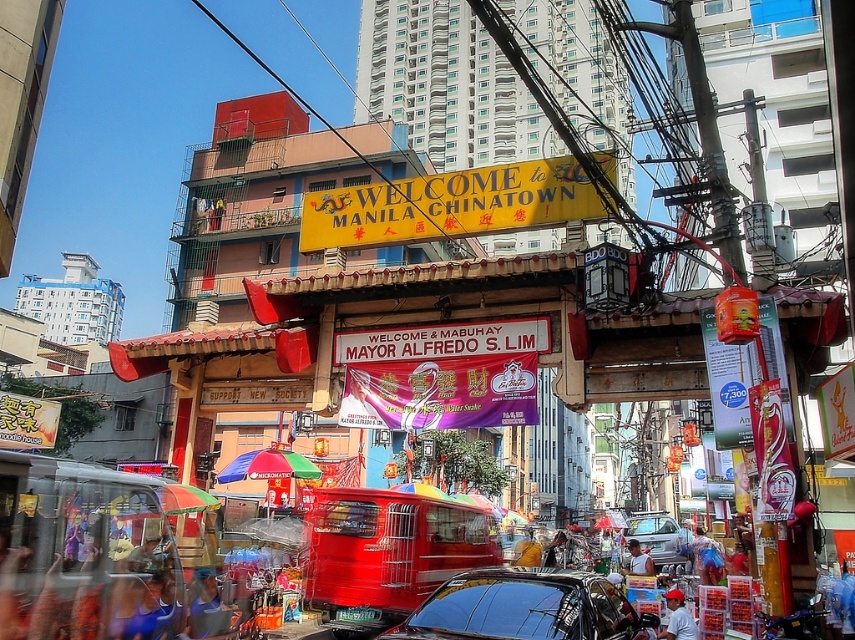
You are a photographer standing in front of the Manila Chinatown archway. You see a person wearing a red cap at center and another wearing a light blue shirt at center. If you want to take a clear photo of both, which object should you focus on first to ensure both are in focus?

You should focus on the red cap at center first because it is closer to the viewer than the light blue shirt at center. By focusing on the closer object, the background object will still be in focus due to the depth of field.

You are a photographer standing in front of the traditional Chinese archway in Manila Chinatown. You want to take a photo that includes both the shiny black car at center and the light blue shirt at center. Which object should you focus on first to ensure both are in clear view?

You should focus on the shiny black car at center first because it is closer to the viewer than the light blue shirt at center. By focusing on the closer object, both will be in clear view due to the depth of field.

You are a photographer standing at the entrance of Manila Chinatown. You want to take a photo of the shiny black car at center and the light blue shirt at center in the same frame. Given that your camera has a maximum focus range of 20 meters, will both subjects be in focus?

The shiny black car at center and light blue shirt at center are 20.43 meters apart. Since the camera can only focus up to 20 meters, the distance between them exceeds the focus range, so both subjects cannot be in focus simultaneously.